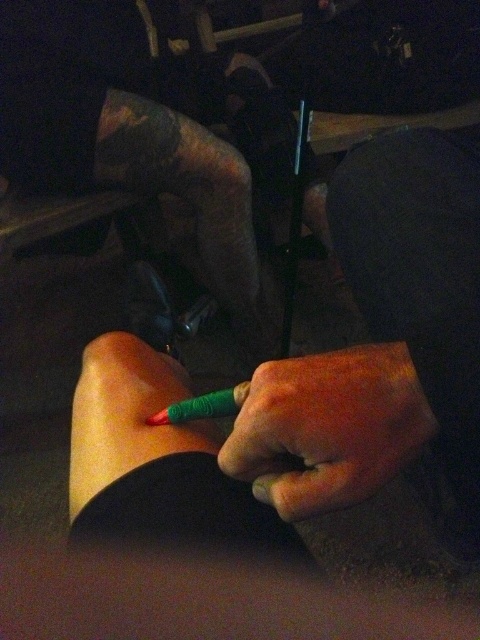
Between point (291, 445) and point (116, 474), which one is positioned behind?

Point (116, 474)

How much distance is there between green matte pencil at center and green matte pencil at lower left?

green matte pencil at center is 5.75 inches from green matte pencil at lower left.

Between point (393, 417) and point (82, 449), which one is positioned in front?

Positioned in front is point (393, 417).

Identify the location of green matte pencil at center. (327, 428).

Can you confirm if green matte pencil at center is taller than green matte pen at center?

Yes.

This screenshot has width=480, height=640. What do you see at coordinates (327, 428) in the screenshot? I see `green matte pencil at center` at bounding box center [327, 428].

Identify the location of green matte pencil at center. (327, 428).

Does green matte pencil at lower left have a greater width compared to green matte pen at center?

Yes, green matte pencil at lower left is wider than green matte pen at center.

Between green matte pencil at lower left and green matte pen at center, which one appears on the right side from the viewer's perspective?

green matte pen at center is more to the right.

Between point (156, 352) and point (164, 417), which one is positioned behind?

The point (156, 352) is behind.

You are a GUI agent. You are given a task and a screenshot of the screen. Output one action in this format:
    pyautogui.click(x=<x>, y=<y>)
    Task: Click on the green matte pencil at lower left
    The image size is (480, 640).
    Given the screenshot: What is the action you would take?
    pyautogui.click(x=126, y=416)